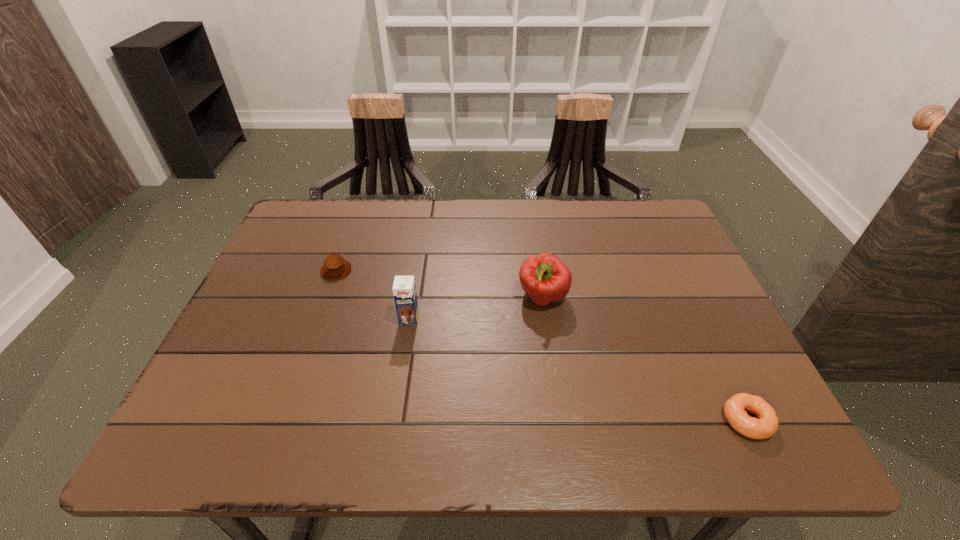
The image size is (960, 540). Find the location of `vacant area between the muffin and the bell pepper`. vacant area between the muffin and the bell pepper is located at coordinates (440, 284).

The width and height of the screenshot is (960, 540). What are the coordinates of `vacant area that lies between the second object from left to right and the third object from left to right` in the screenshot? It's located at (476, 308).

Locate an element on the screen. This screenshot has height=540, width=960. free space between the muffin and the bell pepper is located at coordinates [440, 284].

This screenshot has width=960, height=540. Identify the location of free space between the leftmost object and the third object from left to right. (440, 284).

Identify the location of vacant point located between the second object from left to right and the bell pepper. (476, 308).

Where is `free space between the third object from left to right and the leftmost object`? The height and width of the screenshot is (540, 960). free space between the third object from left to right and the leftmost object is located at coordinates (440, 284).

The height and width of the screenshot is (540, 960). I want to click on vacant area that lies between the rightmost object and the third object from left to right, so click(x=644, y=359).

Identify the location of vacant area that lies between the third object from left to right and the chocolate milk. (476, 308).

The image size is (960, 540). In order to click on empty space that is in between the third object from left to right and the rightmost object in this screenshot , I will do `click(644, 359)`.

This screenshot has width=960, height=540. Identify the location of the third closest object to the nearest object. pos(335,267).